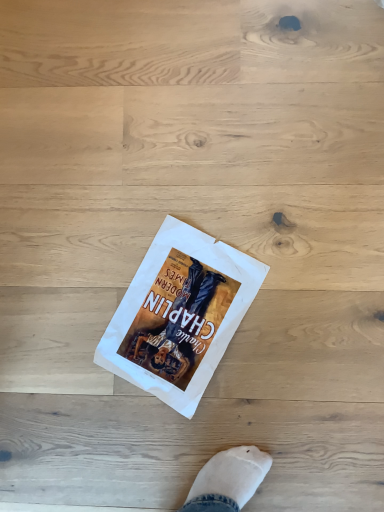
The height and width of the screenshot is (512, 384). I want to click on white paper bag at center, so click(179, 314).

What do you see at coordinates (179, 314) in the screenshot?
I see `white paper bag at center` at bounding box center [179, 314].

Locate an element on the screen. white paper bag at center is located at coordinates (179, 314).